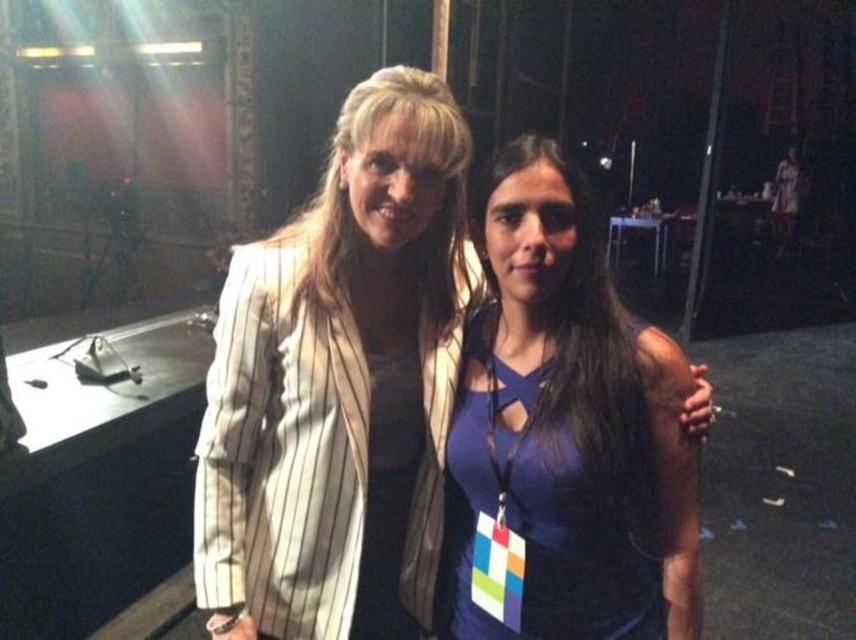
You are standing at the point marked as point (229, 568) in the image. You want to move to the nearest exit, which is located 2 meters away from your current position. Can you safely walk straight ahead without encountering any obstacles?

The distance between point (229, 568) and the viewer is 1.27 meters. Since the exit is 2 meters away, you can safely walk straight ahead as there is enough space before reaching the exit.

You are a photographer setting up for a photoshoot. You have two outfits to display on a mannequin. The white pinstriped blazer at center and the purple matte dress at center. The mannequin can only fit one outfit at a time. Based on their sizes, which outfit should you choose to ensure it looks properly displayed without being too tight or too loose?

The white pinstriped blazer at center is bigger than the purple matte dress at center, so the purple matte dress at center would be better for proper display since it is smaller and less likely to look loose on the mannequin.

Based on the coordinates provided, which object is located at point (340, 385) in the image?

The white pinstriped blazer at center is located at point (340, 385).